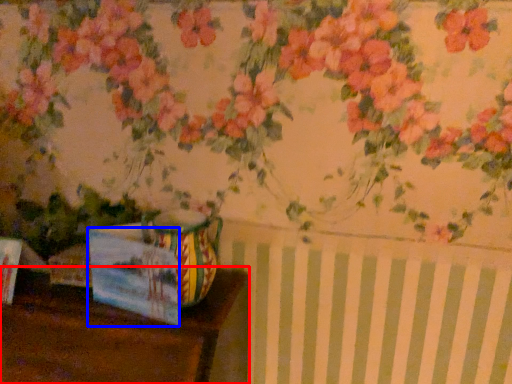
Question: Which object appears farthest to the camera in this image, table (highlighted by a red box) or postcard (highlighted by a blue box)?

Choices:
 (A) table
 (B) postcard

Answer: (B)